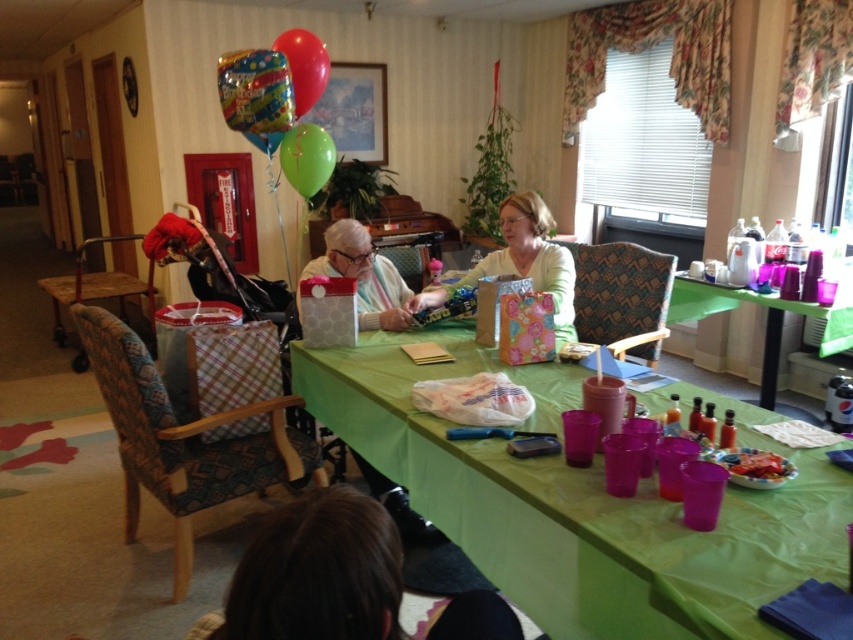
You are a delivery person who needs to place a small package on the green fabric table at center without disturbing the matte white shirt at center. Can you fit the package between them if the package is 22 inches wide?

The green fabric table at center and matte white shirt at center are 23.41 inches apart, so yes, the package can be placed between them as the distance is sufficient to accommodate the 22 inches width.

You are a guest at a party and want to place a small gift on the green fabric table at center. However, you notice the multicolored metallic balloon at upper center. Will the balloon interfere with placing the gift on the table?

The green fabric table at center is in front of the multicolored metallic balloon at upper center, so the balloon is behind the table. Therefore, the balloon will not interfere with placing the gift on the table.

You are a photographer setting up for an event. You notice the matte white shirt at center and the green rubber balloon at upper center in your frame. Which object should you adjust your camera focus to prioritize if you want to capture the taller object in sharp detail?

The matte white shirt at center is taller than the green rubber balloon at upper center, so you should prioritize focusing on the matte white shirt at center to capture it in sharp detail.